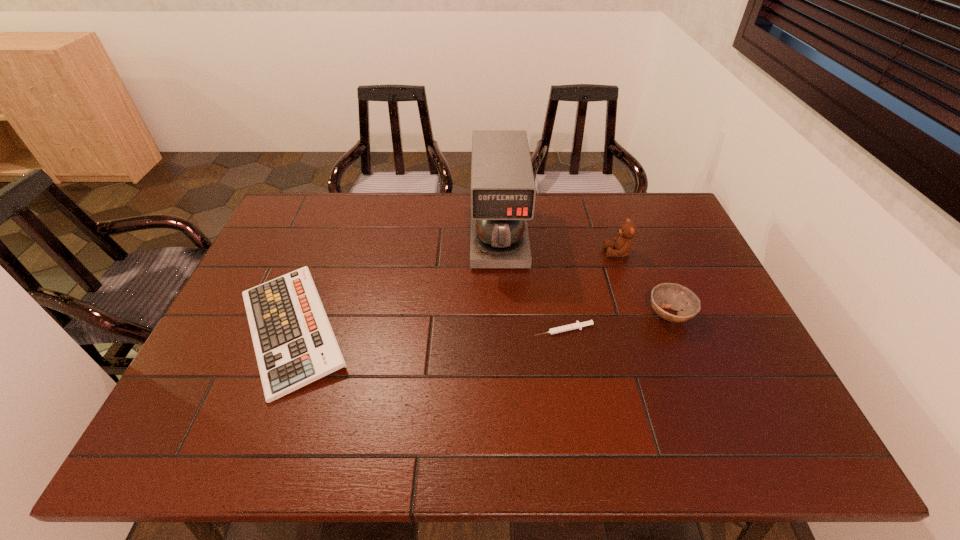
Locate an element on the screen. The width and height of the screenshot is (960, 540). coffee maker is located at coordinates (503, 191).

Where is `teddy bear`? This screenshot has width=960, height=540. teddy bear is located at coordinates (623, 243).

What are the coordinates of `the third tallest object` in the screenshot? It's located at (672, 296).

What are the coordinates of `the leftmost object` in the screenshot? It's located at (294, 343).

This screenshot has width=960, height=540. In order to click on the second shortest object in this screenshot , I will do `click(294, 343)`.

This screenshot has width=960, height=540. I want to click on syringe, so click(577, 325).

You are a GUI agent. You are given a task and a screenshot of the screen. Output one action in this format:
    pyautogui.click(x=<x>, y=<y>)
    Task: Click on the vacant space situated on the carafe side of the tallest object
    The width and height of the screenshot is (960, 540).
    Given the screenshot: What is the action you would take?
    pyautogui.click(x=501, y=293)

Where is `free space located on the face of the teddy bear`? This screenshot has width=960, height=540. free space located on the face of the teddy bear is located at coordinates (546, 252).

The width and height of the screenshot is (960, 540). I want to click on free spot located on the face of the teddy bear, so click(498, 252).

Identify the location of free space located on the face of the teddy bear. (514, 252).